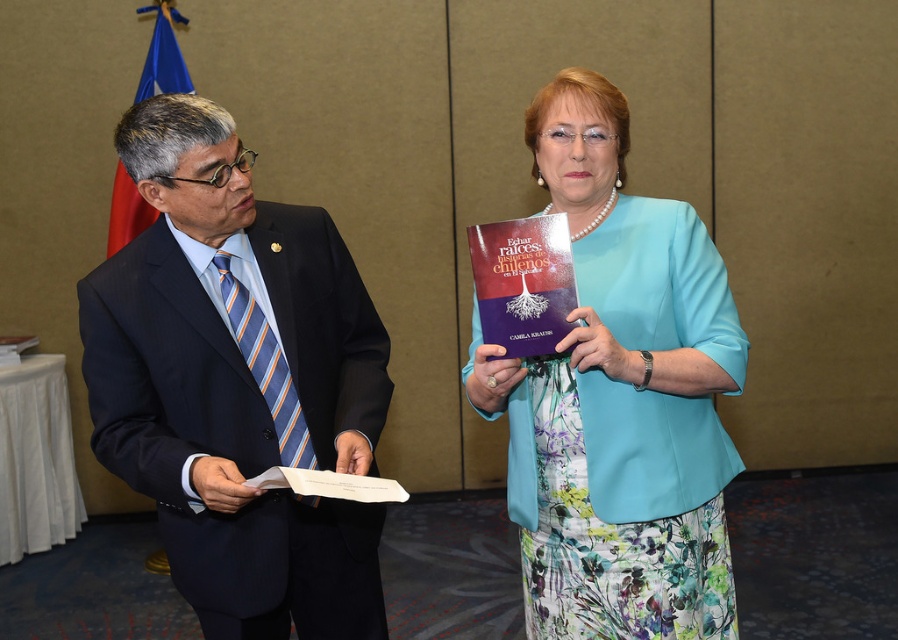
Does floral dress at center appear under purple matte book at center?

Yes.

Can you confirm if floral dress at center is thinner than purple matte book at center?

Incorrect, floral dress at center's width is not less than purple matte book at center's.

You are a GUI agent. You are given a task and a screenshot of the screen. Output one action in this format:
    pyautogui.click(x=<x>, y=<y>)
    Task: Click on the floral dress at center
    
    Given the screenshot: What is the action you would take?
    pyautogui.click(x=619, y=397)

Does dark blue suit at left lie behind purple matte book at center?

No, dark blue suit at left is closer to the viewer.

Measure the distance between point (326, 365) and camera.

Point (326, 365) and camera are 1.84 meters apart from each other.

Identify the location of dark blue suit at left. (236, 384).

Where is `dark blue suit at left`? dark blue suit at left is located at coordinates pos(236,384).

Who is lower down, dark blue suit at left or floral dress at center?

dark blue suit at left

Identify the location of dark blue suit at left. (236, 384).